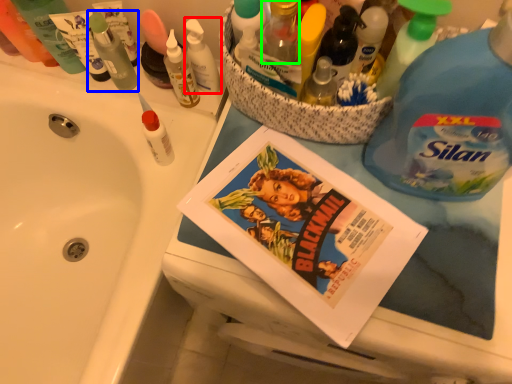
Question: Which is farther away from toiletry (highlighted by a red box)? toiletry (highlighted by a blue box) or toiletry (highlighted by a green box)?

Choices:
 (A) toiletry
 (B) toiletry

Answer: (B)